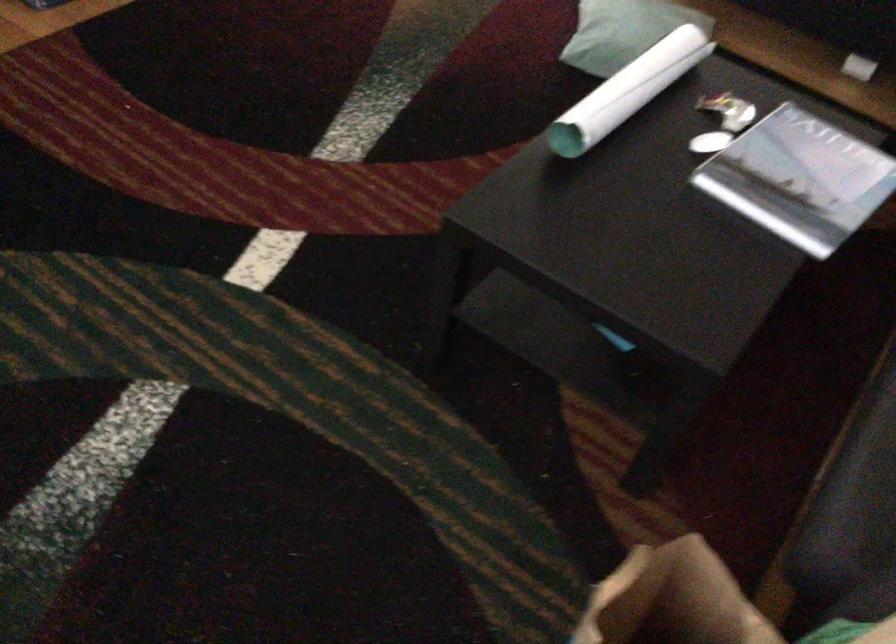
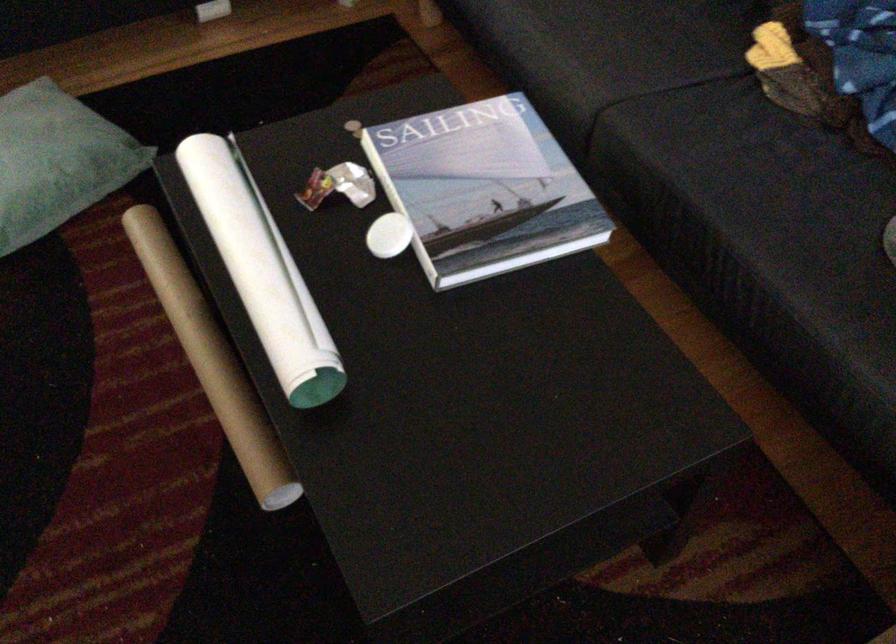
Locate, in the second image, the point that corresponds to pixel 616 84 in the first image.

(262, 270)